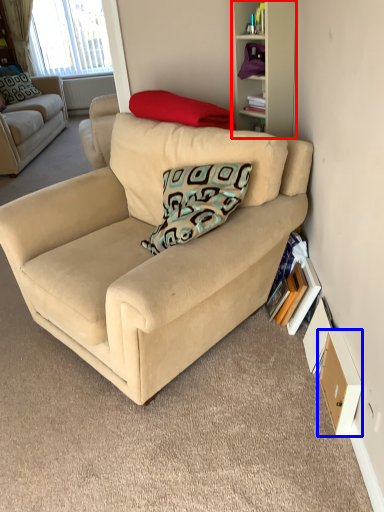
Question: Which of the following is the closest to the observer, cabinet (highlighted by a red box) or drawer (highlighted by a blue box)?

Choices:
 (A) cabinet
 (B) drawer

Answer: (B)